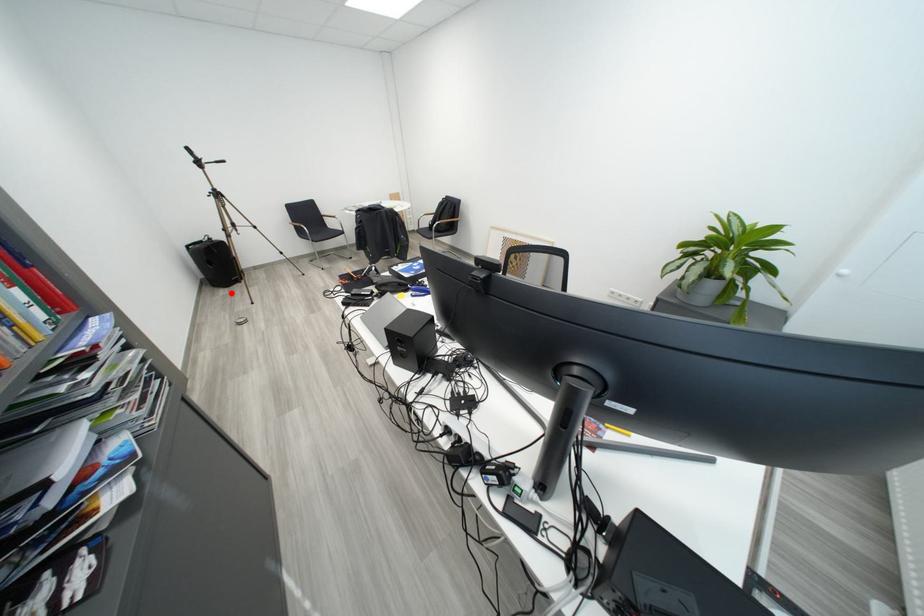
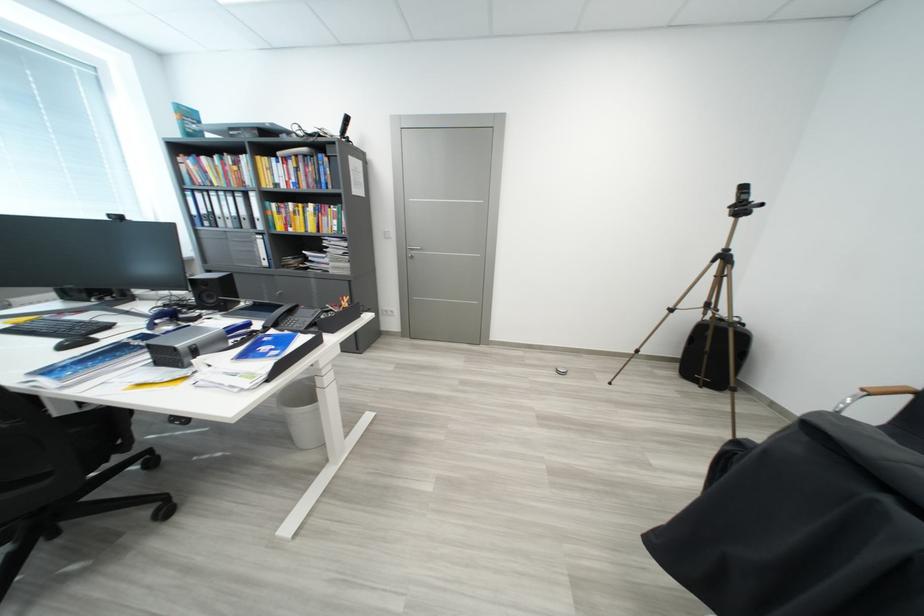
Where in the second image is the point corresponding to the highlighted location from the first image?

(684, 377)